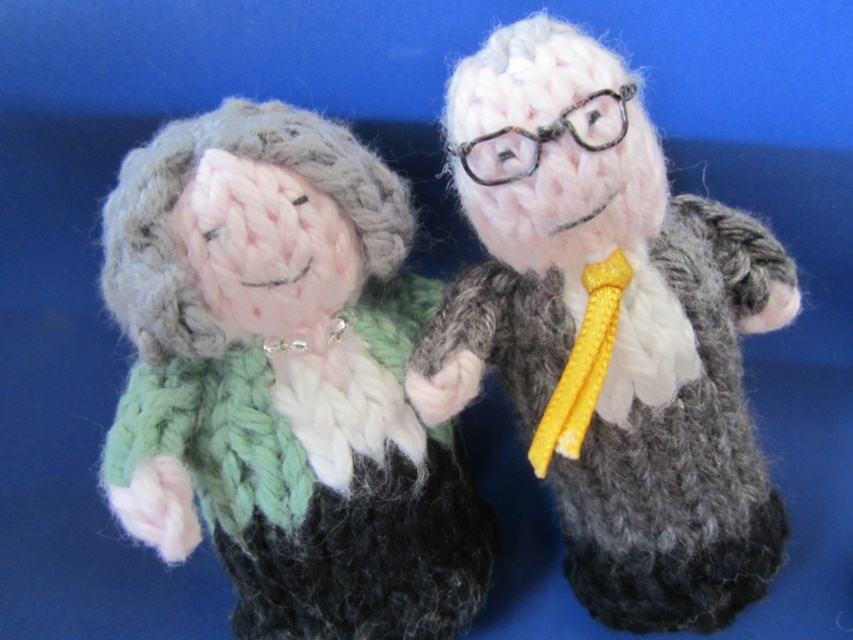
Question: Is knitted woolen doll at center below knitted woolen suit at center?

Choices:
 (A) no
 (B) yes

Answer: (B)

Question: Which of the following is the farthest from the observer?

Choices:
 (A) (674, 384)
 (B) (241, 392)

Answer: (A)

Question: Can you confirm if knitted woolen doll at center is thinner than knitted woolen suit at center?

Choices:
 (A) no
 (B) yes

Answer: (A)

Question: Which point is farther from the camera taking this photo?

Choices:
 (A) (190, 456)
 (B) (477, 337)

Answer: (A)

Question: Is knitted woolen doll at center closer to camera compared to knitted woolen suit at center?

Choices:
 (A) no
 (B) yes

Answer: (A)